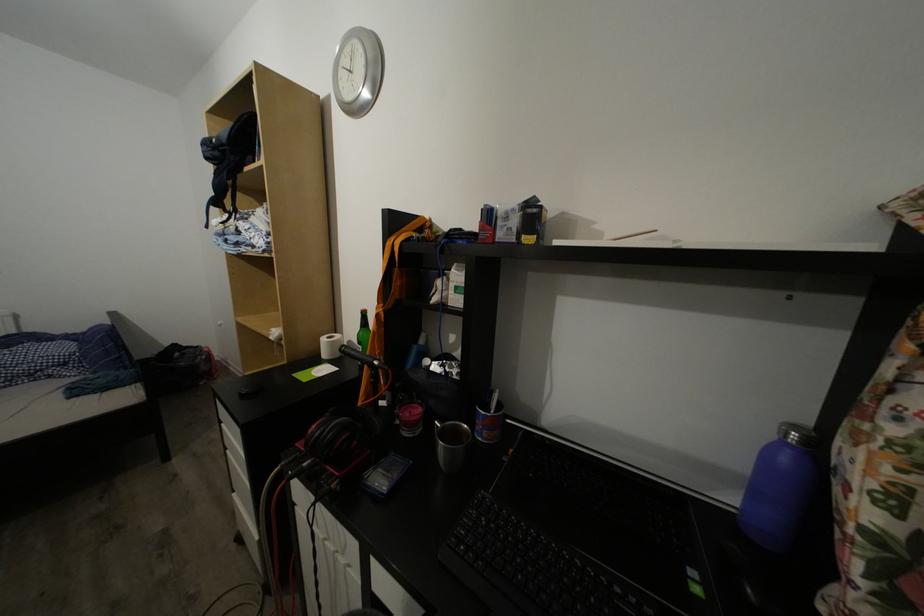
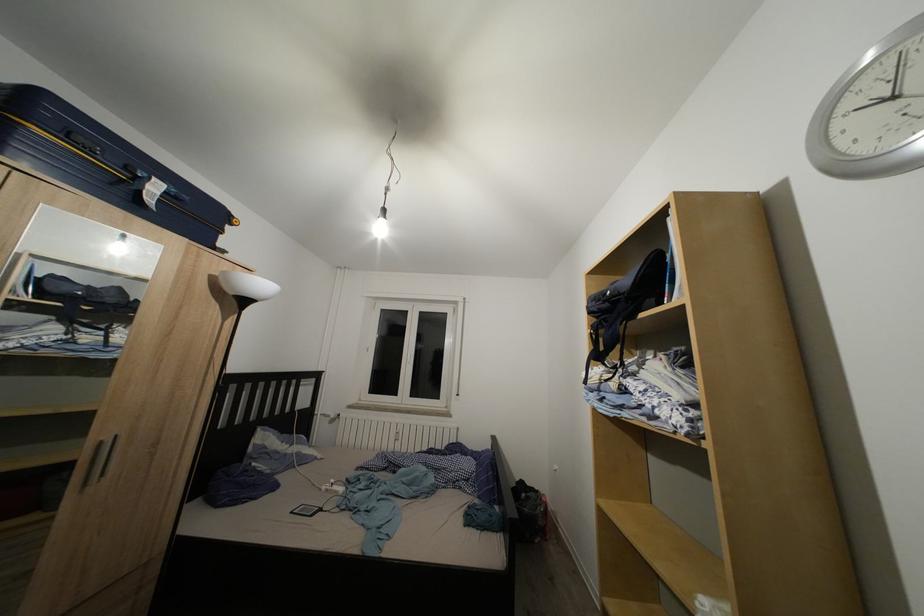
The first image is from the beginning of the video and the second image is from the end. How did the camera likely rotate when shooting the video?

The camera rotated toward left-up.